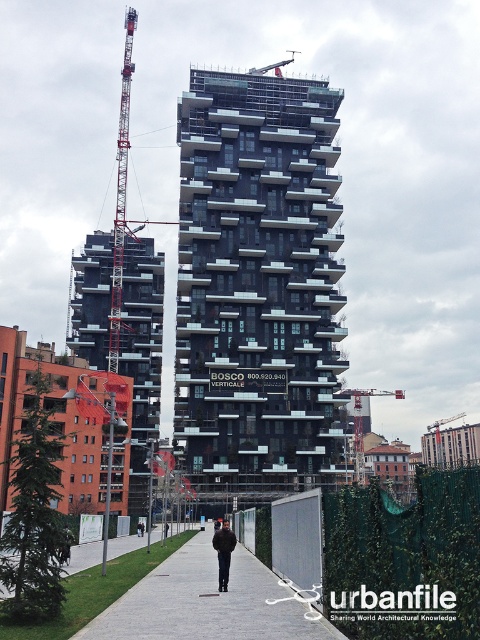
Question: Among these points, which one is nearest to the camera?

Choices:
 (A) (220, 570)
 (B) (117, 314)

Answer: (A)

Question: Among these objects, which one is nearest to the camera?

Choices:
 (A) metallic construction crane at center
 (B) red metal crane at upper left
 (C) black leather jacket at center

Answer: (C)

Question: Among these points, which one is farthest from the camera?

Choices:
 (A) (86, 625)
 (B) (388, 392)

Answer: (B)

Question: Does gray concrete pavement at lower center have a larger size compared to metallic construction crane at center?

Choices:
 (A) no
 (B) yes

Answer: (A)

Question: Is black glass building at center thinner than gray concrete pavement at lower center?

Choices:
 (A) yes
 (B) no

Answer: (B)

Question: Is the position of black glass building at center more distant than that of black leather jacket at center?

Choices:
 (A) yes
 (B) no

Answer: (A)